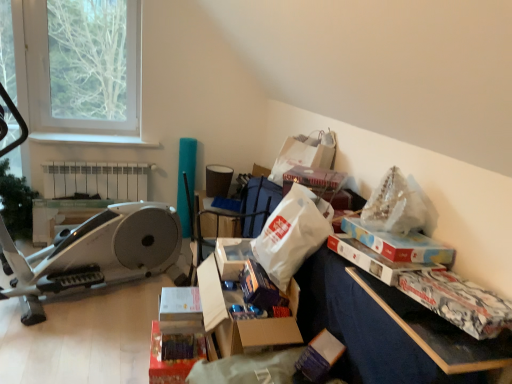
Question: From their relative heights in the image, would you say white paper bag at upper center, which is the 3th paper bag from front to back, is taller or shorter than translucent plastic bag at upper right, the third paper bag when ordered from back to front?

Choices:
 (A) tall
 (B) short

Answer: (A)

Question: Which is correct: white paper bag at upper center, the first paper bag positioned from the back, is inside translucent plastic bag at upper right, which is the first paper bag from front to back, or outside of it?

Choices:
 (A) outside
 (B) inside

Answer: (A)

Question: Which of these objects is positioned farthest from the white plastic radiator at upper left?

Choices:
 (A) matte cardboard storage box at center, which is the 2th storage box from top to bottom
 (B) white paper bag at upper center, the first paper bag positioned from the back
 (C) cardboard box at center, the 1th storage box when ordered from right to left
 (D) translucent plastic bag at upper right, which is the first paper bag from front to back
 (E) white matte paper bag at center, the second paper bag positioned from the back

Answer: (D)

Question: Estimate the real-world distances between objects in this image. Which object is closer to the white matte paper bag at center, marked as the 2th paper bag in a front-to-back arrangement?

Choices:
 (A) translucent plastic bag at upper right, which is the first paper bag from front to back
 (B) white plastic radiator at upper left
 (C) cardboard box at center, marked as the 2th storage box in a left-to-right arrangement
 (D) white paper bag at upper center, which is the 3th paper bag from front to back
 (E) matte cardboard storage box at center, acting as the 1th storage box starting from the bottom

Answer: (C)